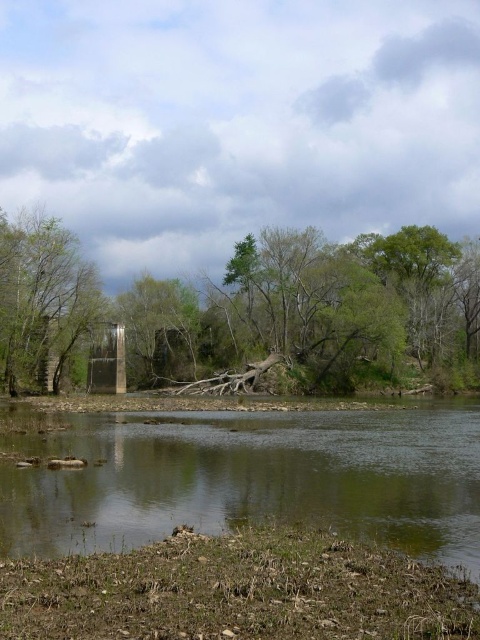
Question: Is green reflective water at center below green matte tree at left?

Choices:
 (A) yes
 (B) no

Answer: (A)

Question: Does green reflective water at center lie behind green matte tree at left?

Choices:
 (A) yes
 (B) no

Answer: (B)

Question: Which object appears farthest from the camera in this image?

Choices:
 (A) green matte tree at left
 (B) green reflective water at center

Answer: (A)

Question: Can you confirm if brown rough tree at center is wider than green matte tree at left?

Choices:
 (A) yes
 (B) no

Answer: (A)

Question: Which point is closer to the camera?

Choices:
 (A) green matte tree at left
 (B) brown rough tree at center

Answer: (A)

Question: Which point is farther to the camera?

Choices:
 (A) brown rough tree at center
 (B) green matte tree at left
 (C) green reflective water at center

Answer: (A)